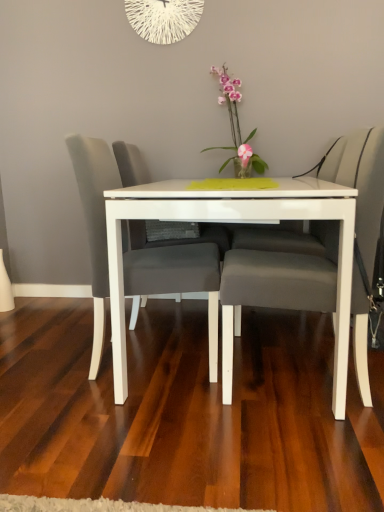
Image resolution: width=384 pixels, height=512 pixels. I want to click on vacant region to the left of matte gray swivel chair at center, so click(x=67, y=327).